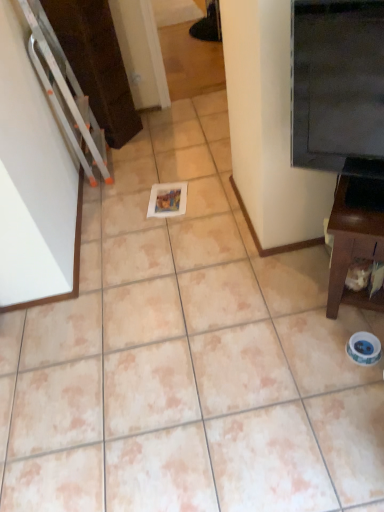
The image size is (384, 512). In order to click on black glossy fridge at upper right in this screenshot , I will do `click(338, 86)`.

What do you see at coordinates (338, 86) in the screenshot? I see `black glossy fridge at upper right` at bounding box center [338, 86].

What is the approximate height of black glossy fridge at upper right?

The height of black glossy fridge at upper right is 22.87 inches.

Measure the distance between point (332, 37) and camera.

A distance of 3.63 feet exists between point (332, 37) and camera.

What do you see at coordinates (355, 239) in the screenshot? I see `brown wood tv stand at right` at bounding box center [355, 239].

In order to click on brown wood tv stand at right in this screenshot , I will do `click(355, 239)`.

Find the location of a particular element. Image resolution: width=384 pixels, height=512 pixels. black glossy fridge at upper right is located at coordinates coord(338,86).

Considering the relative positions of black glossy fridge at upper right and brown wood tv stand at right in the image provided, is black glossy fridge at upper right to the right of brown wood tv stand at right from the viewer's perspective?

In fact, black glossy fridge at upper right is to the left of brown wood tv stand at right.

From the picture: Which object is more forward, black glossy fridge at upper right or brown wood tv stand at right?

black glossy fridge at upper right is closer to the camera.

Considering the points (371, 95) and (376, 252), which point is in front, point (371, 95) or point (376, 252)?

The point (371, 95) is closer.

From the image's perspective, would you say black glossy fridge at upper right is positioned over brown wood tv stand at right?

Yes, from the image's perspective, black glossy fridge at upper right is on top of brown wood tv stand at right.

From a real-world perspective, is black glossy fridge at upper right over brown wood tv stand at right?

Indeed, from a real-world perspective, black glossy fridge at upper right stands above brown wood tv stand at right.

Can you confirm if black glossy fridge at upper right is thinner than brown wood tv stand at right?

Yes.

Who is taller, black glossy fridge at upper right or brown wood tv stand at right?

black glossy fridge at upper right is taller.

Considering the sizes of black glossy fridge at upper right and brown wood tv stand at right in the image, is black glossy fridge at upper right bigger or smaller than brown wood tv stand at right?

black glossy fridge at upper right is smaller than brown wood tv stand at right.

Looking at this image, would you say black glossy fridge at upper right contains brown wood tv stand at right?

No.

Is black glossy fridge at upper right in contact with brown wood tv stand at right?

black glossy fridge at upper right is not next to brown wood tv stand at right, and they're not touching.

Consider the image. Is black glossy fridge at upper right facing towards brown wood tv stand at right?

No, black glossy fridge at upper right does not turn towards brown wood tv stand at right.

From the picture: How distant is black glossy fridge at upper right from brown wood tv stand at right?

They are 26.53 centimeters apart.

Find the location of a particular element. The width and height of the screenshot is (384, 512). furniture beneath the black glossy fridge at upper right (from a real-world perspective) is located at coordinates (355, 239).

In the image, is brown wood tv stand at right on the left side or the right side of black glossy fridge at upper right?

From the image, it's evident that brown wood tv stand at right is to the right of black glossy fridge at upper right.

Relative to black glossy fridge at upper right, is brown wood tv stand at right in front or behind?

brown wood tv stand at right is behind black glossy fridge at upper right.

Considering the positions of point (378, 190) and point (348, 166), is point (378, 190) closer or farther from the camera than point (348, 166)?

Point (378, 190).

From the image's perspective, between brown wood tv stand at right and black glossy fridge at upper right, who is located below?

brown wood tv stand at right, from the image's perspective.

From a real-world perspective, is brown wood tv stand at right positioned above or below black glossy fridge at upper right?

brown wood tv stand at right is below black glossy fridge at upper right.

Looking at this image, looking at their sizes, would you say brown wood tv stand at right is wider or thinner than black glossy fridge at upper right?

brown wood tv stand at right is wider than black glossy fridge at upper right.

From their relative heights in the image, would you say brown wood tv stand at right is taller or shorter than black glossy fridge at upper right?

brown wood tv stand at right is shorter than black glossy fridge at upper right.

Is brown wood tv stand at right bigger than black glossy fridge at upper right?

Yes.

Could black glossy fridge at upper right be considered to be inside brown wood tv stand at right?

No, black glossy fridge at upper right is not surrounded by brown wood tv stand at right.

Is there a large distance between brown wood tv stand at right and black glossy fridge at upper right?

Actually, brown wood tv stand at right and black glossy fridge at upper right are a little close together.

Is brown wood tv stand at right oriented towards black glossy fridge at upper right?

No, brown wood tv stand at right is not aimed at black glossy fridge at upper right.

Can you tell me how much brown wood tv stand at right and black glossy fridge at upper right differ in facing direction?

The angle between the facing direction of brown wood tv stand at right and the facing direction of black glossy fridge at upper right is 1.31 degrees.

I want to click on furniture that appears below the black glossy fridge at upper right (from a real-world perspective), so click(355, 239).

I want to click on furniture that appears behind the black glossy fridge at upper right, so click(355, 239).

Locate an element on the screen. This screenshot has height=512, width=384. fridge that appears above the brown wood tv stand at right (from a real-world perspective) is located at coordinates (338, 86).